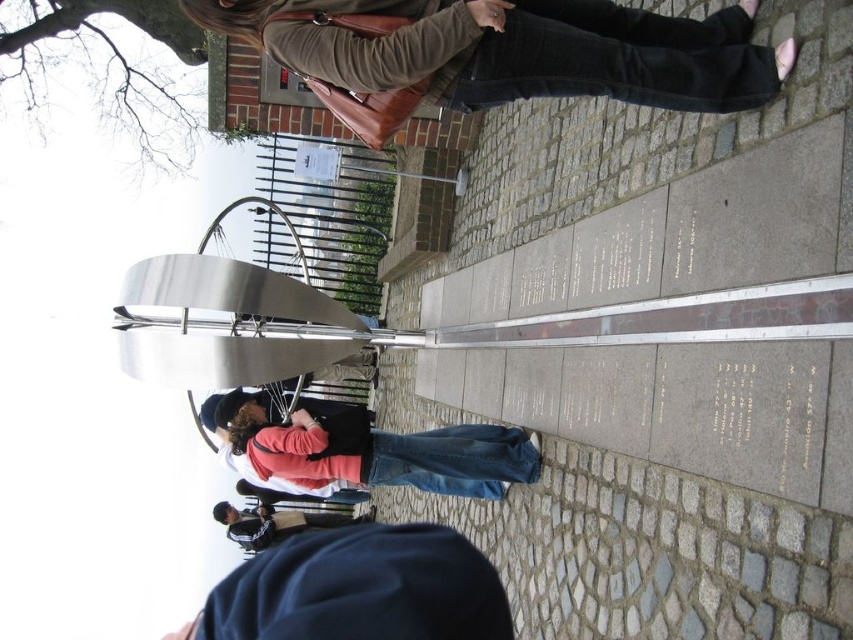
Is the position of brown leather jacket at upper center less distant than that of black leather skateboard at lower center?

Yes, brown leather jacket at upper center is closer to the viewer.

Does brown leather jacket at upper center appear on the right side of black leather skateboard at lower center?

Correct, you'll find brown leather jacket at upper center to the right of black leather skateboard at lower center.

Find the location of a particular element. The width and height of the screenshot is (853, 640). brown leather jacket at upper center is located at coordinates (518, 51).

Locate an element on the screen. The image size is (853, 640). brown leather jacket at upper center is located at coordinates (518, 51).

Which is in front, point (531, 451) or point (277, 538)?

Point (531, 451) is more forward.

Does point (368, 461) come behind point (256, 531)?

That is False.

The width and height of the screenshot is (853, 640). I want to click on denim pants at lower center, so click(x=386, y=452).

You are a GUI agent. You are given a task and a screenshot of the screen. Output one action in this format:
    pyautogui.click(x=<x>, y=<y>)
    Task: Click on the denim pants at lower center
    
    Given the screenshot: What is the action you would take?
    (x=386, y=452)

Can you confirm if brown leather jacket at upper center is positioned below denim pants at lower center?

No, brown leather jacket at upper center is not below denim pants at lower center.

Which is more to the left, brown leather jacket at upper center or denim pants at lower center?

Positioned to the left is denim pants at lower center.

The width and height of the screenshot is (853, 640). What do you see at coordinates (518, 51) in the screenshot? I see `brown leather jacket at upper center` at bounding box center [518, 51].

Identify the location of brown leather jacket at upper center. The image size is (853, 640). (518, 51).